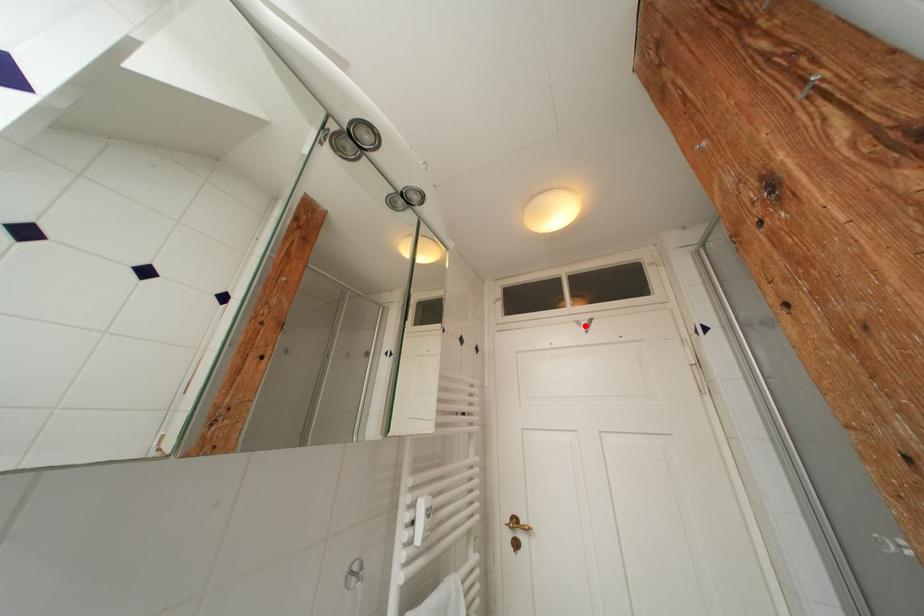
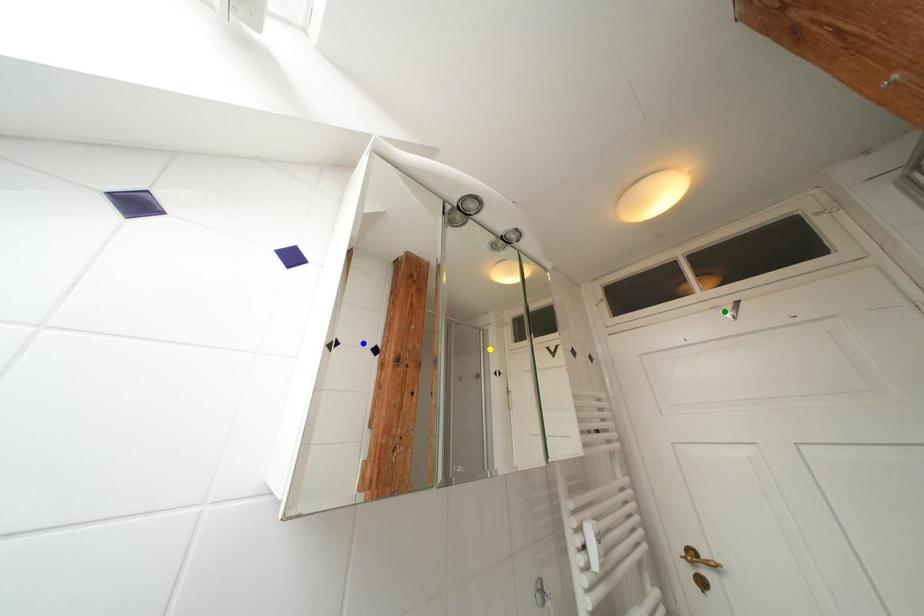
Question: I am providing you with two images of the same scene from different viewpoints. A red point is marked on the first image. You are given multiple points on the second image. Which point in image 2 represents the same 3d spot as the red point in image 1?

Choices:
 (A) blue point
 (B) green point
 (C) yellow point

Answer: (B)